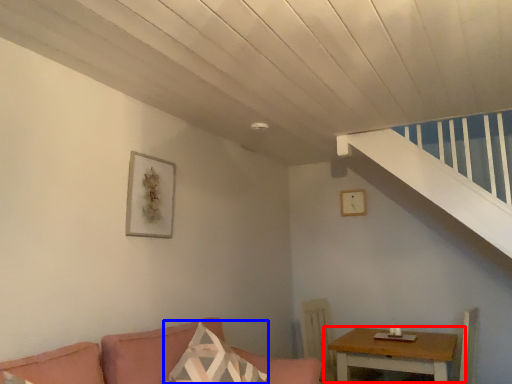
Question: Among these objects, which one is nearest to the camera, table (highlighted by a red box) or pillow (highlighted by a blue box)?

Choices:
 (A) table
 (B) pillow

Answer: (B)